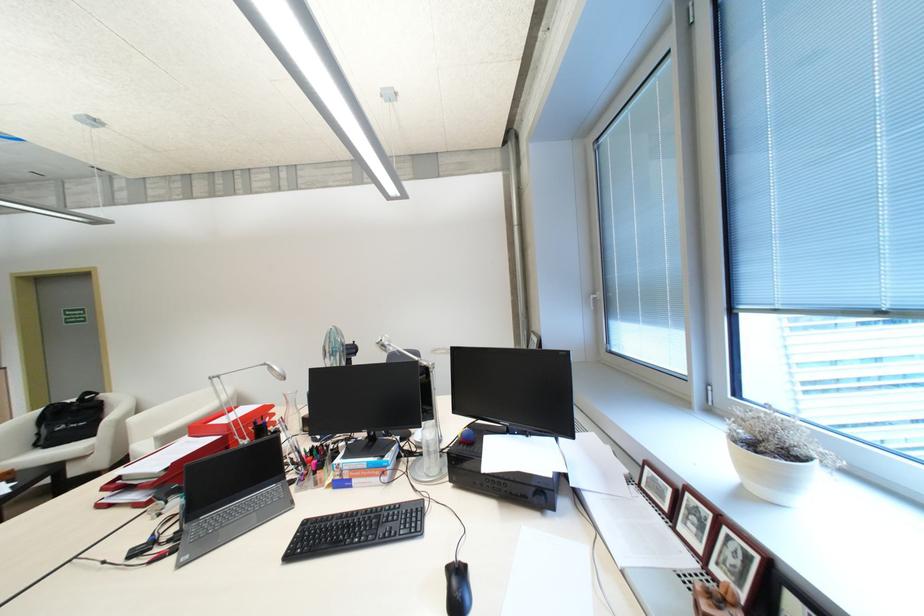
Identify the location of black receiver knob. This screenshot has height=616, width=924. (457, 589).